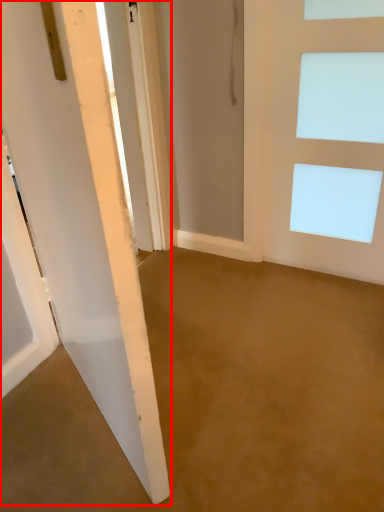
Question: From the image's perspective, where is door (annotated by the red box) located relative to door?

Choices:
 (A) above
 (B) below

Answer: (B)